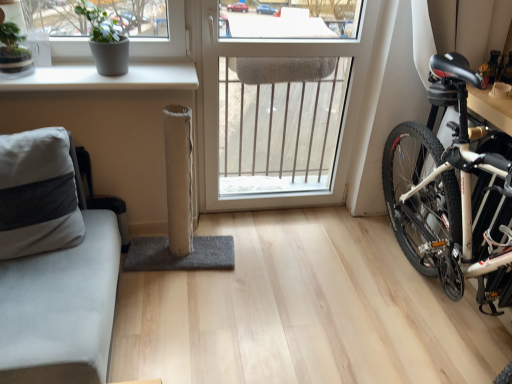
Locate an element on the screen. Image resolution: width=512 pixels, height=384 pixels. free space in front of white plastic window at center is located at coordinates (283, 262).